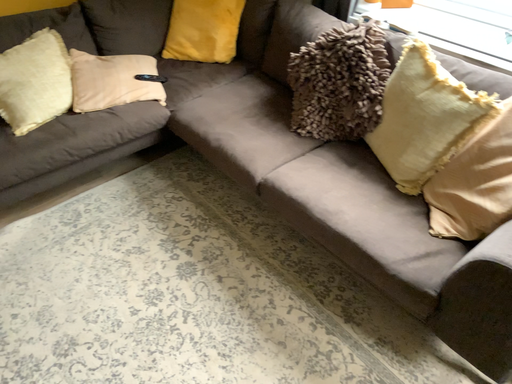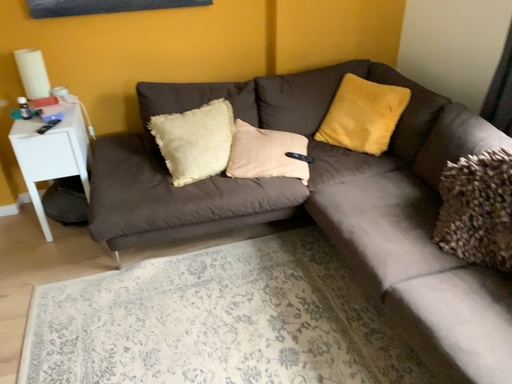
Question: Which way did the camera rotate in the video?

Choices:
 (A) rotated right
 (B) rotated left

Answer: (B)